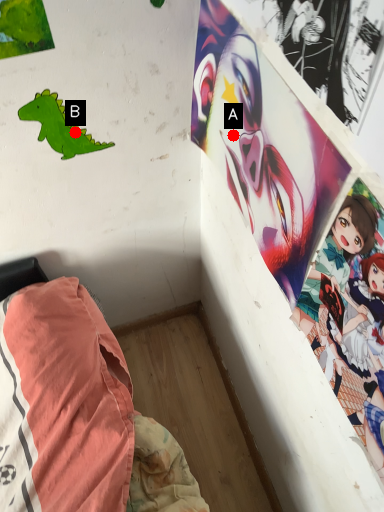
Question: Two points are circled on the image, labeled by A and B beside each circle. Which of the following is the farthest from the observer?

Choices:
 (A) A is further
 (B) B is further

Answer: (B)